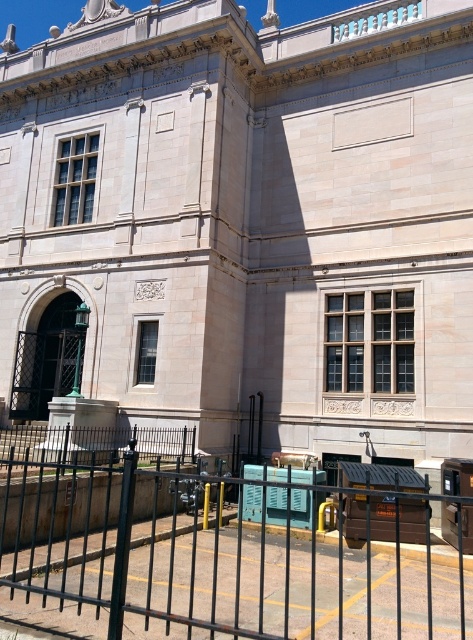
You are standing in front of the classical building and want to walk to the entrance on the left. There is a black metal fence at lower center and a white marble clock at center. Which object should you go around to reach the entrance?

You should go around the black metal fence at lower center because it is positioned on the right side of the white marble clock at center, meaning the entrance is to the left of the clock.

You are standing at the point marked by the coordinate point (210, 557) in the image. Looking towards the black metal fence at lower center, which direction should you walk to reach the green lamppost on the left side of the building?

Since the point (210, 557) marks the black metal fence at lower center, and the green lamppost is on the left side of the building, you should walk towards the left to reach the green lamppost.

You are an architect visiting the building and need to place a new sculpture between the black metal fence at lower center and the white marble clock at center. Considering their sizes, which object should the sculpture be placed closer to?

The sculpture should be placed closer to the white marble clock at center because the black metal fence at lower center is larger in size, leaving more space near the smaller white marble clock at center for the sculpture.